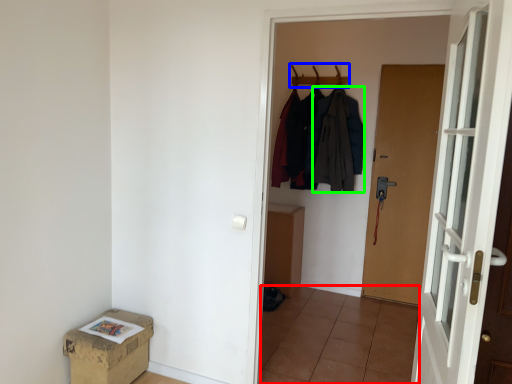
Question: Which object is the closest to the tile (highlighted by a red box)? Choose among these: hanger (highlighted by a blue box) or clothing (highlighted by a green box).

Choices:
 (A) hanger
 (B) clothing

Answer: (B)